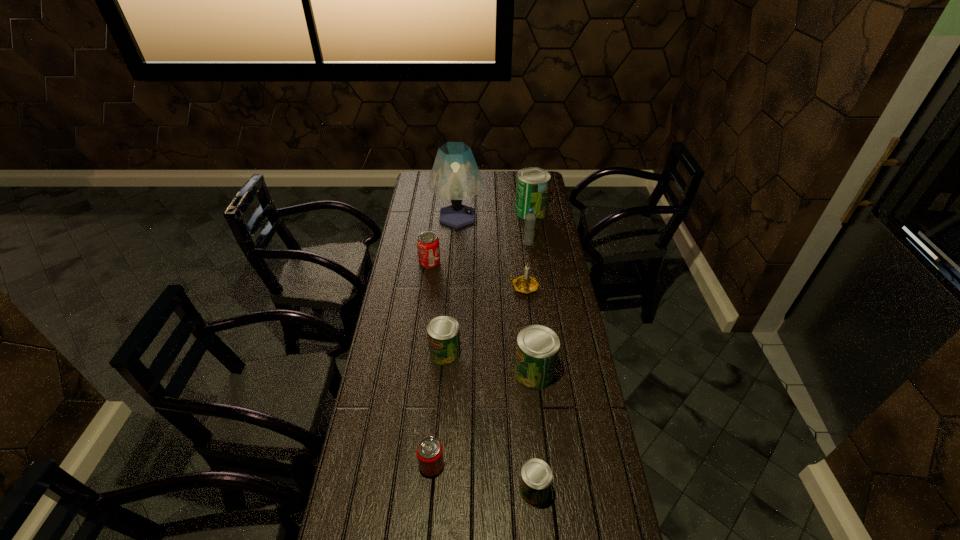
Find the location of a particular element. candle holder is located at coordinates (525, 284).

Image resolution: width=960 pixels, height=540 pixels. Identify the location of the fifth farthest object. (525, 284).

Find the location of a particular element. The width and height of the screenshot is (960, 540). the nearer red can is located at coordinates (429, 451).

Locate an element on the screen. the smallest green can is located at coordinates (536, 476).

The width and height of the screenshot is (960, 540). I want to click on vacant position located on the base of the light lampshade, so click(512, 217).

The image size is (960, 540). I want to click on vacant space located on the front of the farthest green can, so click(537, 251).

Identify the location of vacant space located 0.280m on the back of the third farthest object. The image size is (960, 540). (524, 208).

You are a GUI agent. You are given a task and a screenshot of the screen. Output one action in this format:
    pyautogui.click(x=<x>, y=<y>)
    Task: Click on the vacant area situated 0.340m on the front of the fifth shortest can
    The image size is (960, 540).
    Given the screenshot: What is the action you would take?
    pyautogui.click(x=547, y=491)

Find the location of `vacant space located 0.400m on the back of the farther red can`. vacant space located 0.400m on the back of the farther red can is located at coordinates (437, 208).

You are a GUI agent. You are given a task and a screenshot of the screen. Output one action in this format:
    pyautogui.click(x=<x>, y=<y>)
    Task: Click on the free space located 0.190m on the right of the second smallest green can
    Image resolution: width=960 pixels, height=540 pixels.
    Given the screenshot: What is the action you would take?
    pyautogui.click(x=512, y=353)